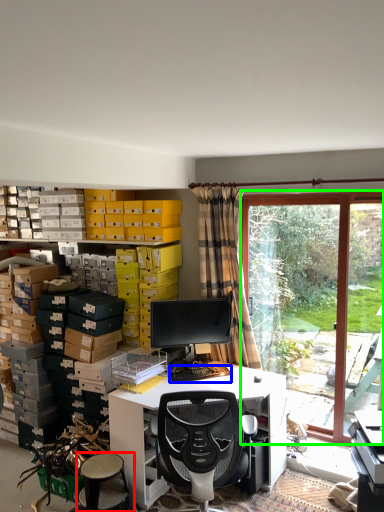
Question: Which object is the farthest from stool (highlighted by a red box)? Choose among these: computer keyboard (highlighted by a blue box) or bay window (highlighted by a green box).

Choices:
 (A) computer keyboard
 (B) bay window

Answer: (B)